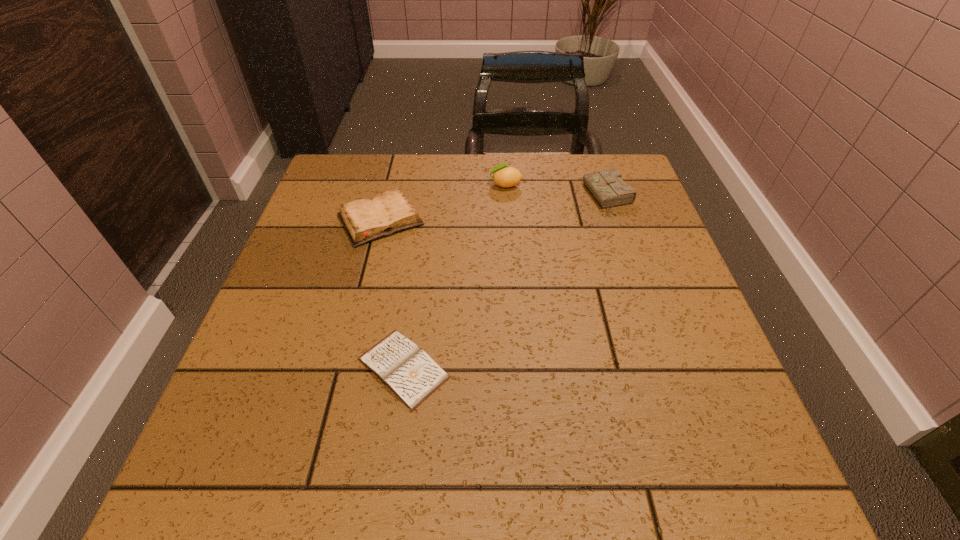
Locate an element on the screen. the tallest object is located at coordinates (504, 176).

The height and width of the screenshot is (540, 960). Identify the location of the second object from right to left. (504, 176).

This screenshot has width=960, height=540. Find the location of `the rightmost object`. the rightmost object is located at coordinates (607, 187).

Where is `the second shortest diary`? This screenshot has width=960, height=540. the second shortest diary is located at coordinates (365, 220).

What are the coordinates of `the shortest object` in the screenshot? It's located at tap(399, 363).

This screenshot has height=540, width=960. What are the coordinates of `the nearest diary` in the screenshot? It's located at (399, 363).

What are the coordinates of `vacant space located 0.150m with leaves positioned above the third object from left to right` in the screenshot? It's located at click(431, 185).

This screenshot has height=540, width=960. What are the coordinates of `free space located 0.370m with leaves positioned above the third object from left to right` in the screenshot? It's located at (349, 185).

You are a GUI agent. You are given a task and a screenshot of the screen. Output one action in this format:
    pyautogui.click(x=<x>, y=<y>)
    Task: Click on the vacant point located with leaves positioned above the third object from left to right
    The width and height of the screenshot is (960, 540).
    Given the screenshot: What is the action you would take?
    pyautogui.click(x=461, y=185)

This screenshot has width=960, height=540. I want to click on vacant space located 0.230m on the left of the rightmost object, so click(496, 197).